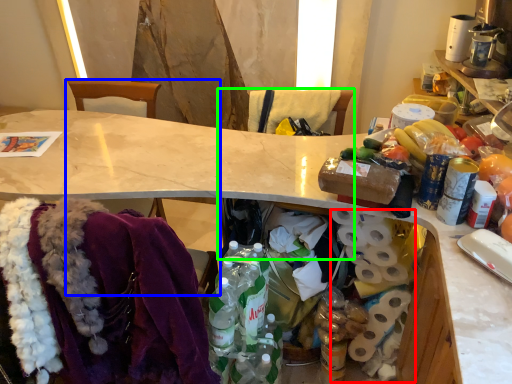
Question: Which is farther away from toilet paper (highlighted by a red box)? chair (highlighted by a blue box) or chair (highlighted by a green box)?

Choices:
 (A) chair
 (B) chair

Answer: (A)